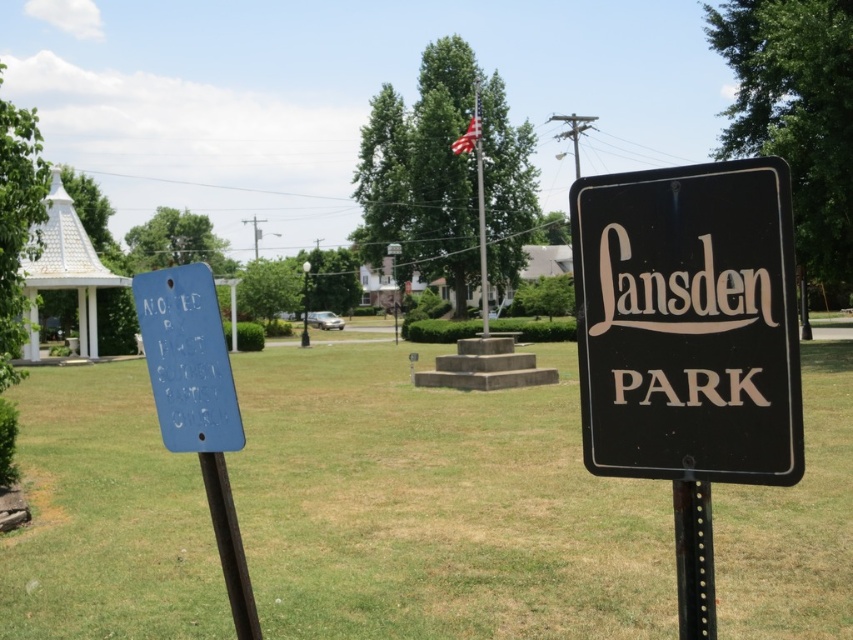
Question: Can you confirm if black plastic sign at center is positioned to the right of blue painted metal sign at left?

Choices:
 (A) yes
 (B) no

Answer: (A)

Question: Among these objects, which one is nearest to the camera?

Choices:
 (A) black metal pole at center
 (B) black plastic sign at center
 (C) green grass at center
 (D) black matte sign at right

Answer: (B)

Question: Can you confirm if green grass at center is smaller than metallic flagpole at center?

Choices:
 (A) no
 (B) yes

Answer: (A)

Question: Among these objects, which one is nearest to the camera?

Choices:
 (A) metallic flagpole at center
 (B) black metal pole at center
 (C) black plastic sign at center
 (D) green grass at center

Answer: (C)

Question: Which object is positioned farthest from the black plastic sign at center?

Choices:
 (A) blue painted metal sign at left
 (B) white shingled gazebo at left
 (C) black metal pole at lower left

Answer: (B)

Question: Can you confirm if black matte sign at right is wider than blue painted metal sign at left?

Choices:
 (A) no
 (B) yes

Answer: (A)